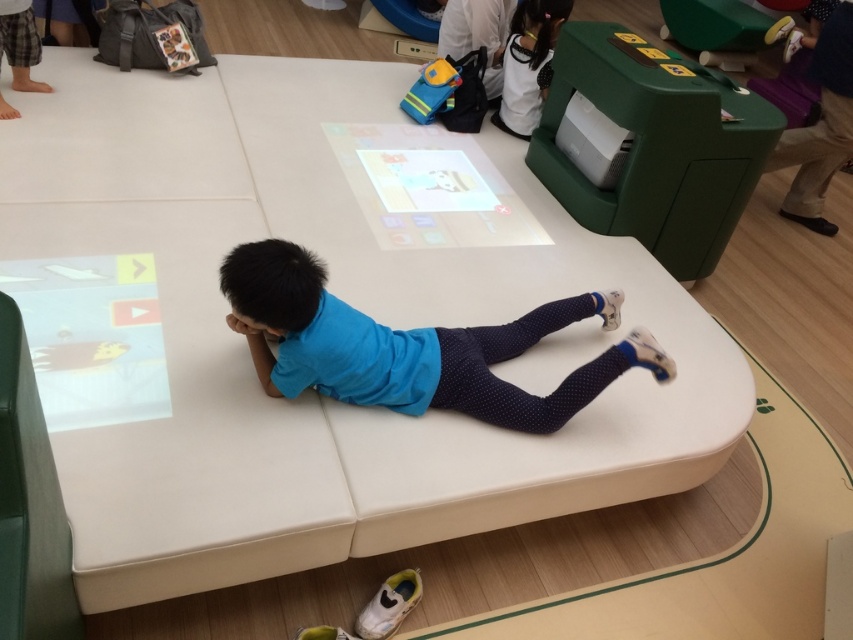
You are a tailor comparing two shirts in the image. The blue fabric shirt at center and the white matte shirt at upper right. Which one has a shorter length?

The blue fabric shirt at center is shorter than the white matte shirt at upper right.

You are a teacher in a classroom. You notice two shirts in the image. Which shirt is closer to the floor, the blue fabric shirt at center or the white matte shirt at upper right?

The blue fabric shirt at center is closer to the floor because it is positioned under the white matte shirt at upper right.

You are a robot navigating the play area. You need to move from point A to point B. Point A is at coordinate point (323, 353) and point B is at coordinate point (532, 3). According to the image, which point is closer to the child?

Point (323, 353) is in front of point (532, 3), so it is closer to the child.